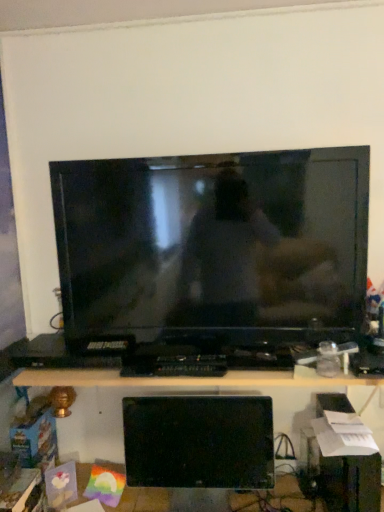
Question: Can we say matte black television at center lies outside black glossy monitor at lower center?

Choices:
 (A) no
 (B) yes

Answer: (B)

Question: Can you confirm if matte black television at center is thinner than black glossy monitor at lower center?

Choices:
 (A) yes
 (B) no

Answer: (B)

Question: Is matte black television at center wider than black glossy monitor at lower center?

Choices:
 (A) yes
 (B) no

Answer: (A)

Question: Is matte black television at center smaller than black glossy monitor at lower center?

Choices:
 (A) yes
 (B) no

Answer: (B)

Question: Can you confirm if matte black television at center is taller than black glossy monitor at lower center?

Choices:
 (A) no
 (B) yes

Answer: (B)

Question: Is matte black television at center next to black glossy monitor at lower center?

Choices:
 (A) no
 (B) yes

Answer: (A)

Question: Considering the relative sizes of matte black television at center and black plastic desk at lower center in the image provided, is matte black television at center taller than black plastic desk at lower center?

Choices:
 (A) yes
 (B) no

Answer: (A)

Question: Is black plastic desk at lower center inside matte black television at center?

Choices:
 (A) no
 (B) yes

Answer: (A)

Question: Is matte black television at center beside black plastic desk at lower center?

Choices:
 (A) yes
 (B) no

Answer: (B)

Question: Is matte black television at center not close to black plastic desk at lower center?

Choices:
 (A) yes
 (B) no

Answer: (B)

Question: Is matte black television at center aimed at black plastic desk at lower center?

Choices:
 (A) no
 (B) yes

Answer: (A)

Question: From a real-world perspective, is matte black television at center located higher than black plastic desk at lower center?

Choices:
 (A) yes
 (B) no

Answer: (A)

Question: Can you confirm if black plastic desk at lower center is smaller than black glossy monitor at lower center?

Choices:
 (A) yes
 (B) no

Answer: (B)